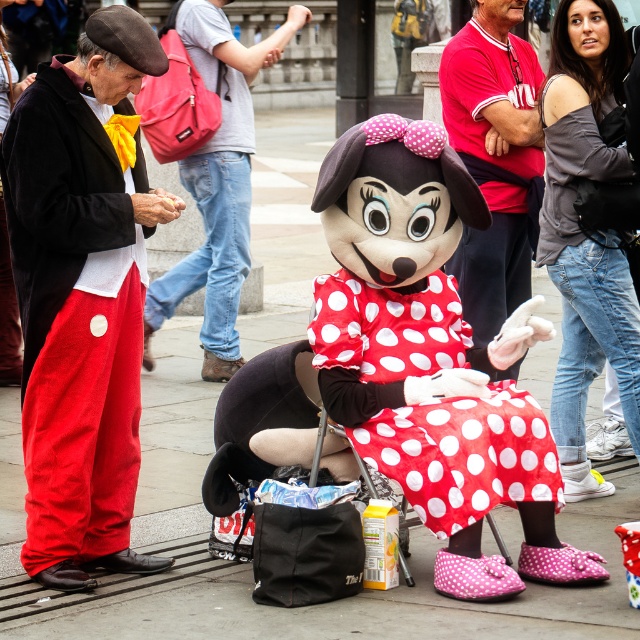
Question: Is velvet red pants at left to the left of polka dot fabric minnie mouse at center from the viewer's perspective?

Choices:
 (A) no
 (B) yes

Answer: (B)

Question: Considering the real-world distances, which object is farthest from the red cotton shirt at center?

Choices:
 (A) velvet red pants at left
 (B) polka dot fabric minnie mouse at center
 (C) red polka dot fabric dress at center

Answer: (A)

Question: Is the position of red polka dot fabric dress at center less distant than that of polka dot fabric minnie mouse at center?

Choices:
 (A) no
 (B) yes

Answer: (B)

Question: Considering the real-world distances, which object is farthest from the red cotton shirt at center?

Choices:
 (A) polka dot fabric minnie mouse at center
 (B) red polka dot fabric dress at center

Answer: (A)

Question: Based on their relative distances, which object is farther from the polka dot fabric minnie mouse at center?

Choices:
 (A) red cotton shirt at center
 (B) velvet red pants at left

Answer: (B)

Question: Does velvet red pants at left appear on the right side of red polka dot fabric dress at center?

Choices:
 (A) no
 (B) yes

Answer: (A)